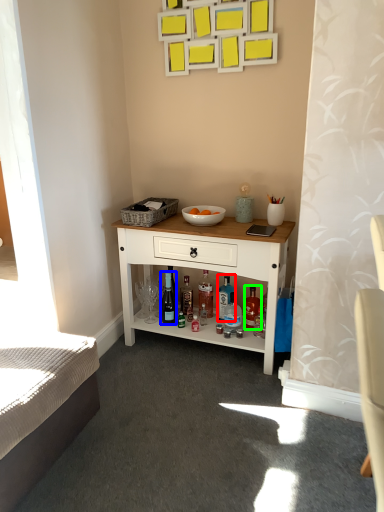
Question: Considering the real-world distances, which object is closest to bottle (highlighted by a red box)? wine bottle (highlighted by a blue box) or bottle (highlighted by a green box).

Choices:
 (A) wine bottle
 (B) bottle

Answer: (B)